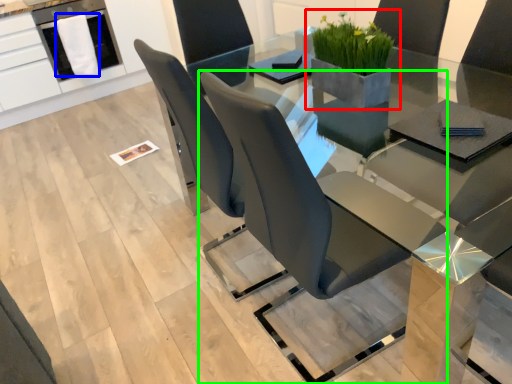
Question: Based on their relative distances, which object is farther from houseplant (highlighted by a red box)? Choose from cloth (highlighted by a blue box) and chair (highlighted by a green box).

Choices:
 (A) cloth
 (B) chair

Answer: (A)